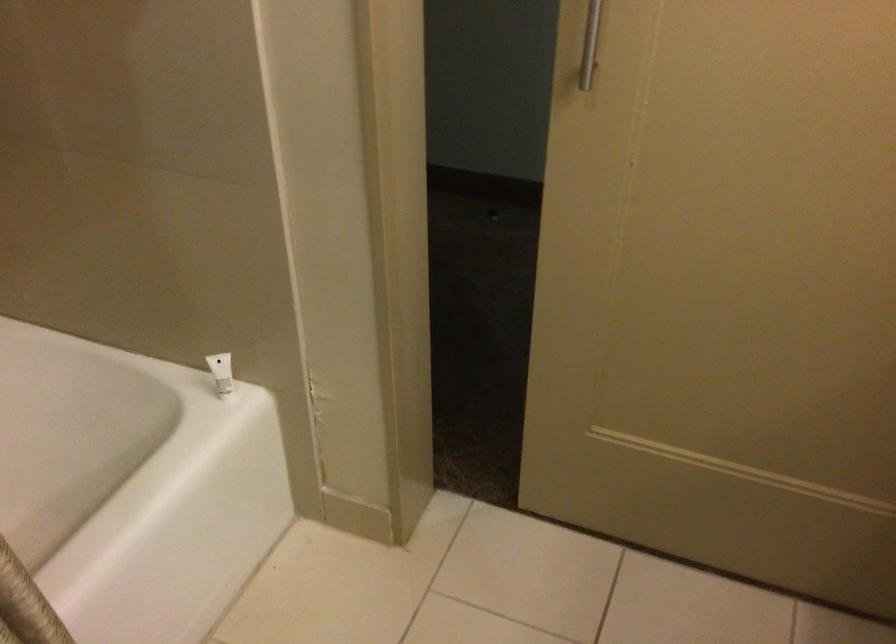
I want to click on silver door handle, so click(x=590, y=44).